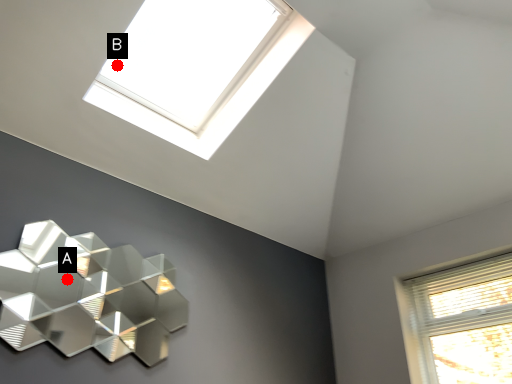
Question: Two points are circled on the image, labeled by A and B beside each circle. Among these points, which one is nearest to the camera?

Choices:
 (A) A is closer
 (B) B is closer

Answer: (B)